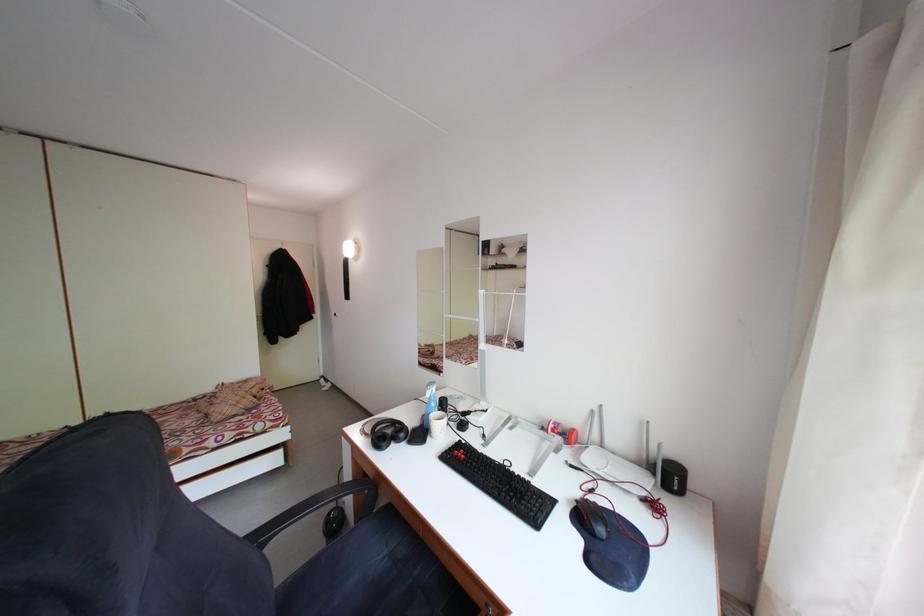
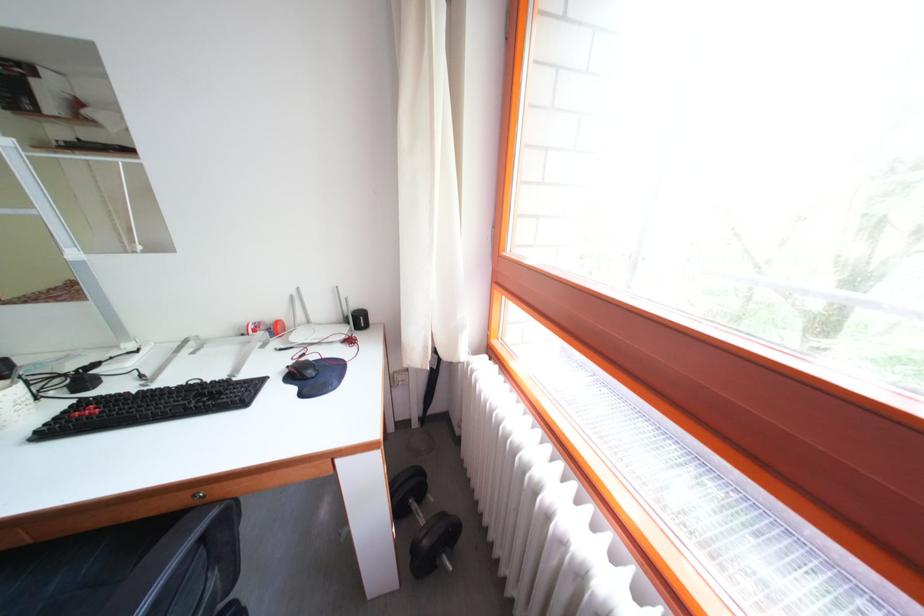
The point at (515,469) is marked in the first image. Where is the corresponding point in the second image?

(201, 389)